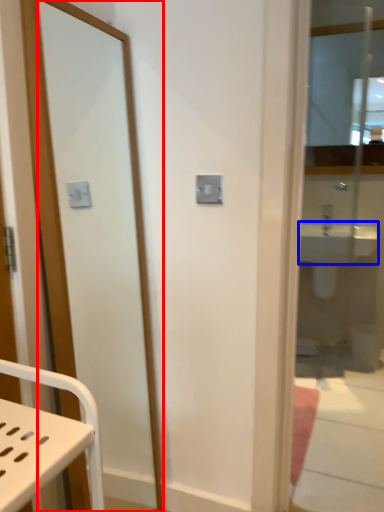
Question: Which of the following is the farthest to the observer, mirror (highlighted by a red box) or sink (highlighted by a blue box)?

Choices:
 (A) mirror
 (B) sink

Answer: (B)